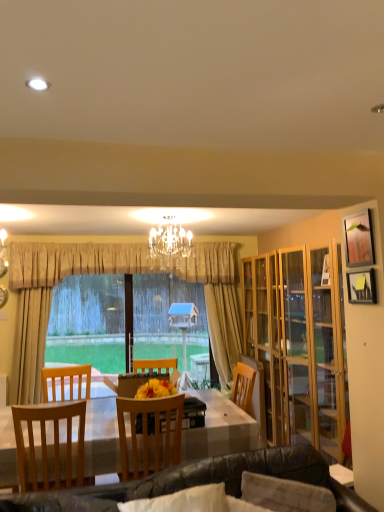
Question: From their relative heights in the image, would you say beige fabric curtain at center is taller or shorter than wooden picture frame at upper right, the 1th picture frame from the top?

Choices:
 (A) tall
 (B) short

Answer: (A)

Question: Which is correct: beige fabric curtain at center is inside wooden picture frame at upper right, the 1th picture frame from the top, or outside of it?

Choices:
 (A) inside
 (B) outside

Answer: (B)

Question: Estimate the real-world distances between objects in this image. Which object is farther from the leather couch at lower center?

Choices:
 (A) wooden picture frame at upper right, the 1th picture frame from the top
 (B) beige fabric curtain at center
 (C) wooden picture frame at upper right, marked as the second picture frame in a top-to-bottom arrangement
 (D) light brown wooden chair at left, the 2th chair when ordered from right to left
 (E) wooden cabinet at right

Answer: (B)

Question: Which object is positioned farthest from the beige fabric curtain at center?

Choices:
 (A) wooden chair at center, the 1th chair viewed from the right
 (B) light brown wooden chair at left, the 1th chair from the left
 (C) crystal chandelier at center
 (D) wooden picture frame at upper right, the first picture frame in the bottom-to-top sequence
 (E) wooden cabinet at right

Answer: (D)